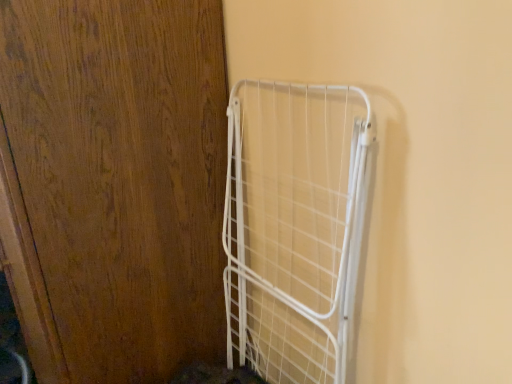
Question: Based on their positions, is wooden door at left located to the left or right of white wire cage at right?

Choices:
 (A) right
 (B) left

Answer: (B)

Question: In terms of size, does wooden door at left appear bigger or smaller than white wire cage at right?

Choices:
 (A) big
 (B) small

Answer: (A)

Question: In terms of width, does wooden door at left look wider or thinner when compared to white wire cage at right?

Choices:
 (A) wide
 (B) thin

Answer: (A)

Question: Is white wire cage at right bigger or smaller than wooden door at left?

Choices:
 (A) big
 (B) small

Answer: (B)

Question: From a real-world perspective, relative to wooden door at left, is white wire cage at right vertically above or below?

Choices:
 (A) above
 (B) below

Answer: (B)

Question: From the image's perspective, is white wire cage at right above or below wooden door at left?

Choices:
 (A) below
 (B) above

Answer: (A)

Question: In terms of width, does white wire cage at right look wider or thinner when compared to wooden door at left?

Choices:
 (A) thin
 (B) wide

Answer: (A)